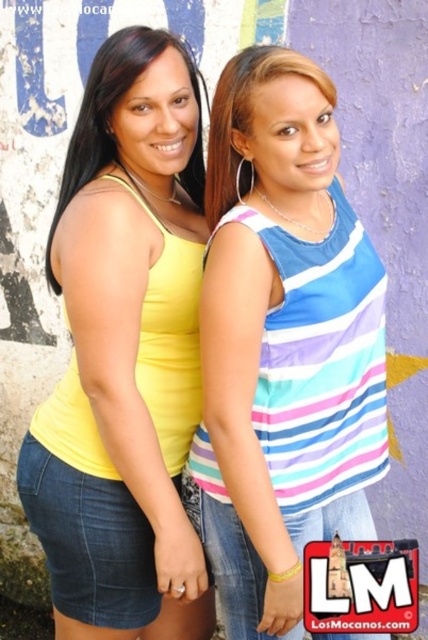
Question: Is striped fabric tank top at center above matte yellow tank top at left?

Choices:
 (A) yes
 (B) no

Answer: (B)

Question: Which object is closer to the camera taking this photo?

Choices:
 (A) striped fabric tank top at center
 (B) matte blue tank top at center
 (C) matte yellow tank top at left

Answer: (A)

Question: Which of the following is the farthest from the observer?

Choices:
 (A) (278, 68)
 (B) (272, 58)
 (C) (86, 92)

Answer: (C)

Question: Which point is closer to the camera?

Choices:
 (A) striped fabric tank top at center
 (B) yellow matte tank top at left
 (C) matte blue tank top at center
 (D) matte yellow tank top at left

Answer: (A)

Question: Where is striped fabric tank top at center located in relation to matte blue tank top at center in the image?

Choices:
 (A) left
 (B) right

Answer: (B)

Question: Can you confirm if matte yellow tank top at left is bigger than matte blue tank top at center?

Choices:
 (A) no
 (B) yes

Answer: (B)